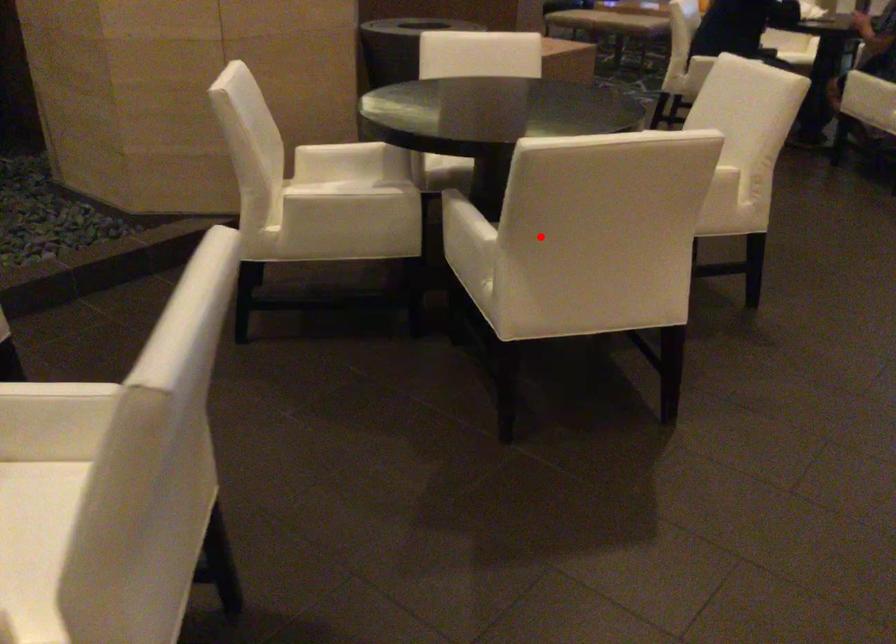
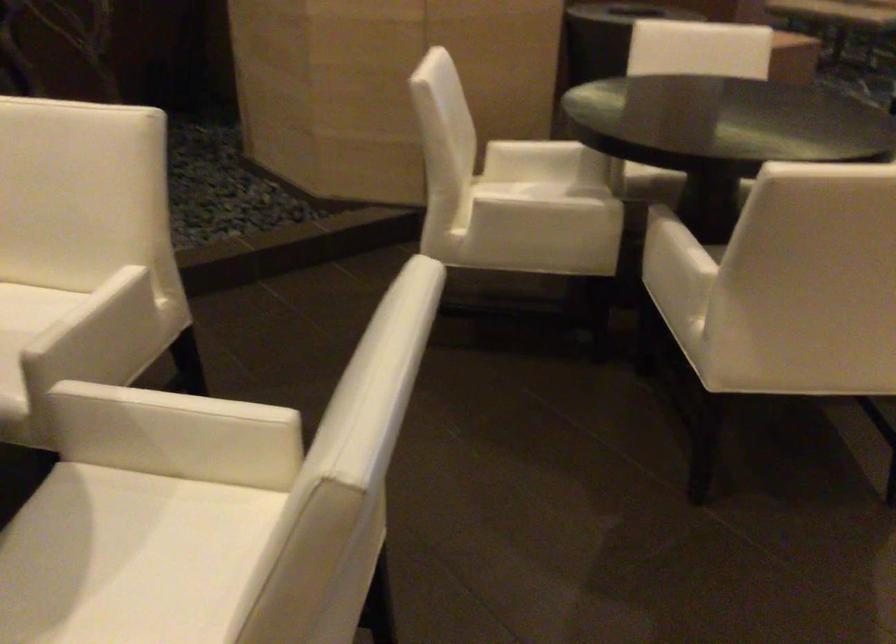
The point at the highlighted location is marked in the first image. Where is the corresponding point in the second image?

(778, 277)